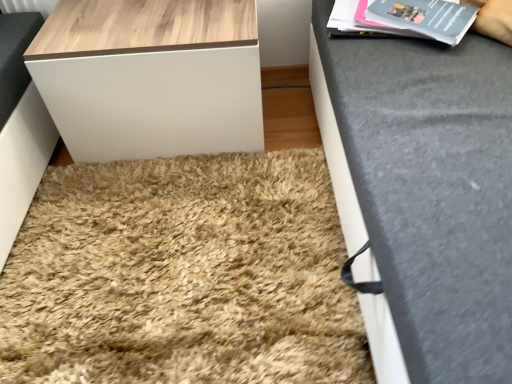
Question: Is beige shaggy rug at center placed right next to matte gray magazine at upper right?

Choices:
 (A) no
 (B) yes

Answer: (A)

Question: Are beige shaggy rug at center and matte gray magazine at upper right far apart?

Choices:
 (A) no
 (B) yes

Answer: (A)

Question: Is beige shaggy rug at center taller than matte gray magazine at upper right?

Choices:
 (A) yes
 (B) no

Answer: (A)

Question: Is beige shaggy rug at center positioned before matte gray magazine at upper right?

Choices:
 (A) no
 (B) yes

Answer: (B)

Question: From a real-world perspective, is beige shaggy rug at center over matte gray magazine at upper right?

Choices:
 (A) yes
 (B) no

Answer: (B)

Question: Is beige shaggy rug at center smaller than matte gray magazine at upper right?

Choices:
 (A) yes
 (B) no

Answer: (B)

Question: Is wooden table at upper left at the back of matte gray magazine at upper right?

Choices:
 (A) no
 (B) yes

Answer: (A)

Question: Is matte gray magazine at upper right not inside wooden table at upper left?

Choices:
 (A) yes
 (B) no

Answer: (A)

Question: Is matte gray magazine at upper right facing towards wooden table at upper left?

Choices:
 (A) yes
 (B) no

Answer: (B)

Question: Is matte gray magazine at upper right further to camera compared to wooden table at upper left?

Choices:
 (A) yes
 (B) no

Answer: (B)

Question: Does matte gray magazine at upper right lie in front of wooden table at upper left?

Choices:
 (A) no
 (B) yes

Answer: (B)

Question: Is matte gray magazine at upper right far away from wooden table at upper left?

Choices:
 (A) yes
 (B) no

Answer: (B)

Question: Does wooden table at upper left contain beige shaggy rug at center?

Choices:
 (A) yes
 (B) no

Answer: (B)